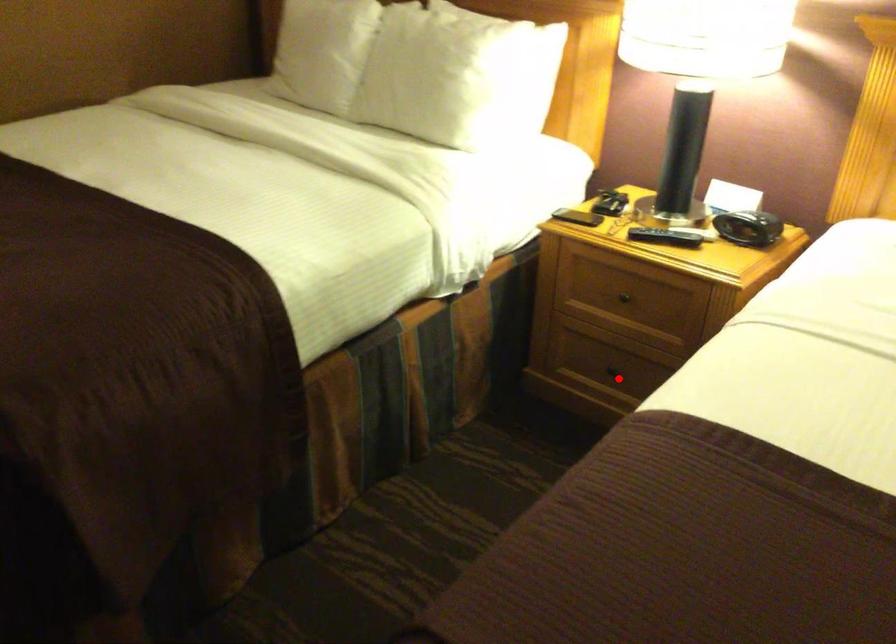
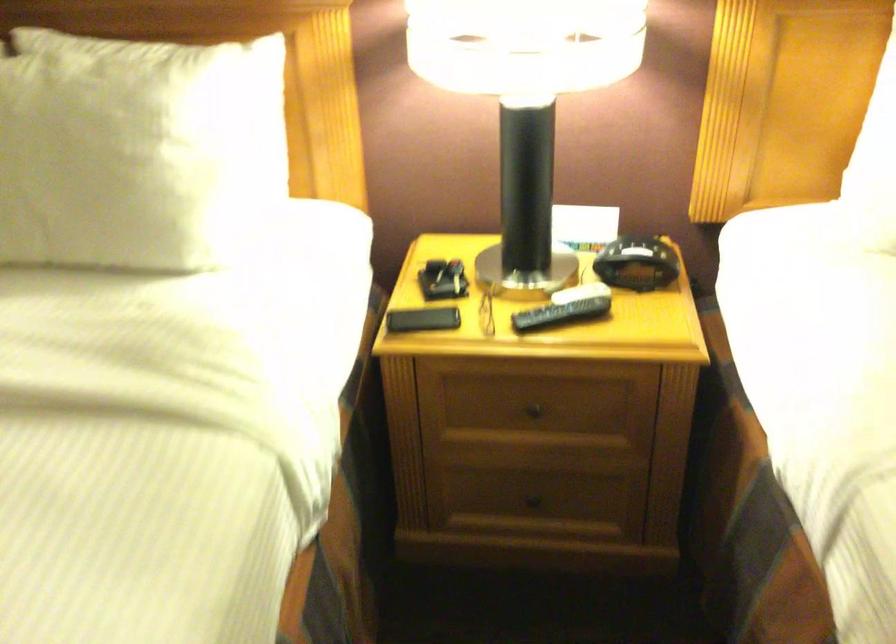
Question: I am providing you with two images of the same scene from different viewpoints. In image1, a red point is highlighted. Considering the same 3D point in image2, which of the following is correct?

Choices:
 (A) It is closer
 (B) It is farther

Answer: (A)